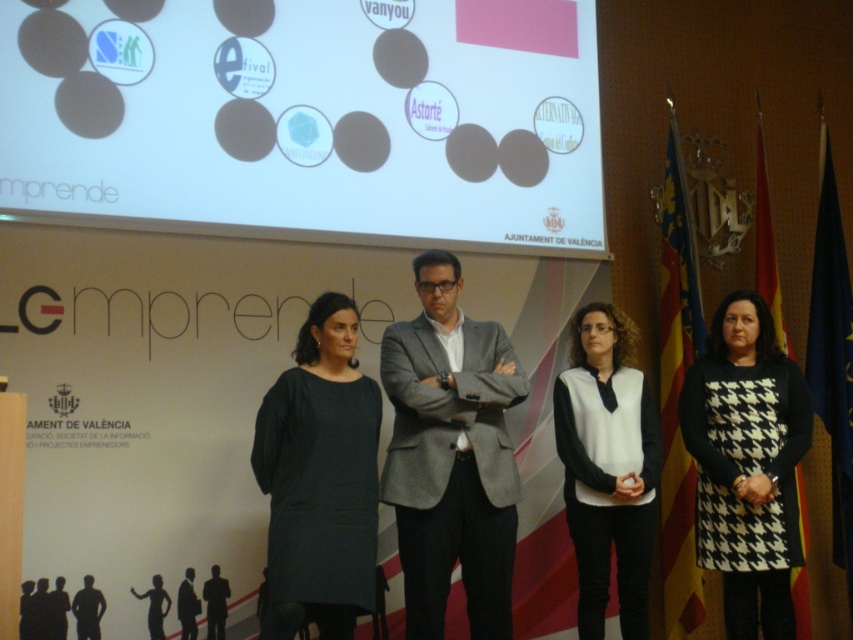
Is dark gray dress at center bigger than black houndstooth dress at right?

Actually, dark gray dress at center might be smaller than black houndstooth dress at right.

Can you confirm if dark gray dress at center is positioned to the right of black houndstooth dress at right?

In fact, dark gray dress at center is to the left of black houndstooth dress at right.

Is point (282, 621) farther from viewer compared to point (732, 580)?

No.

Locate an element on the screen. The height and width of the screenshot is (640, 853). dark gray dress at center is located at coordinates (318, 480).

Can you confirm if gray wool suit at center is shorter than dark gray suit at center?

In fact, gray wool suit at center may be taller than dark gray suit at center.

What are the coordinates of `gray wool suit at center` in the screenshot? It's located at (451, 456).

Does black houndstooth dress at right appear over matte black suit at center?

Yes.

Is black houndstooth dress at right to the left of matte black suit at center from the viewer's perspective?

No, black houndstooth dress at right is not to the left of matte black suit at center.

Does point (700, 502) come in front of point (96, 620)?

That is False.

The image size is (853, 640). Find the location of `black houndstooth dress at right`. black houndstooth dress at right is located at coordinates (747, 465).